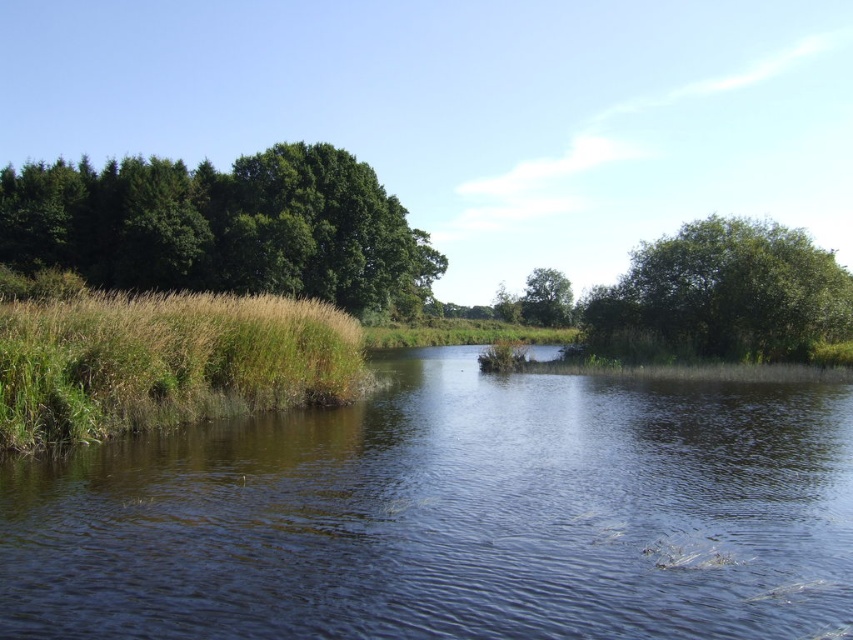
You are a bird flying over the landscape and want to land on the green grassy reed at left. Which direction should you fly to reach it from the green leafy tree at center?

The green grassy reed at left is positioned under the green leafy tree at center, so you should fly downward to reach it.

You are a bird flying over the landscape and want to land on the closest vegetation. Which one should you choose between the green grassy reed at left and the green leafy tree at center?

The green grassy reed at left is closer to you than the green leafy tree at center because the tree is in the background while the reed is in the foreground.

You are standing at the edge of the dark water at center and want to look up to see the green leafy tree at center. In which direction should you look?

You should look upward because the dark water at center is located below the green leafy tree at center, so looking up will allow you to see the tree.